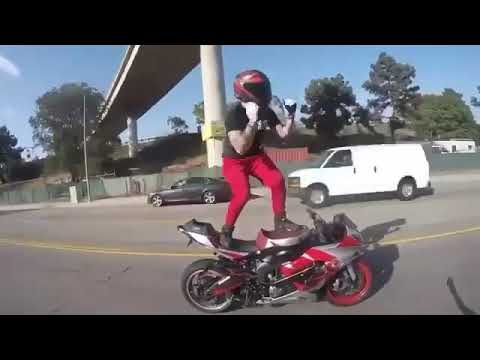
The height and width of the screenshot is (360, 480). In order to click on trashcan in this screenshot , I will do `click(78, 195)`.